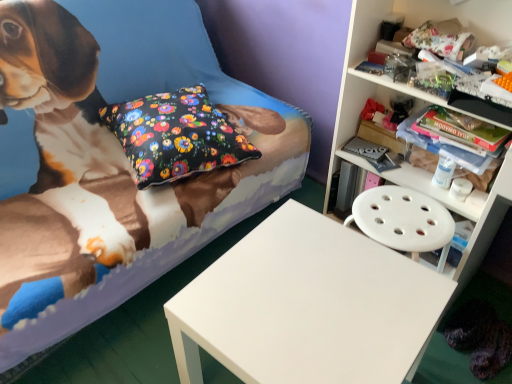
Where is `free space above floral fabric pillow at center (from a real-world perspective)`? free space above floral fabric pillow at center (from a real-world perspective) is located at coordinates (161, 108).